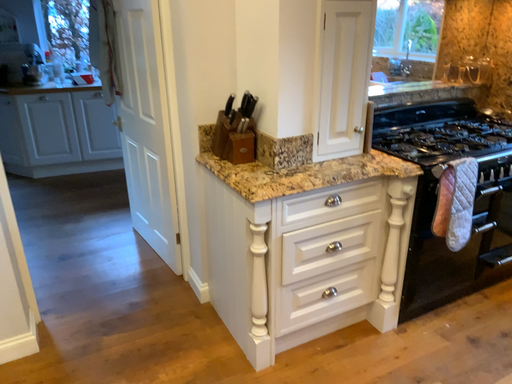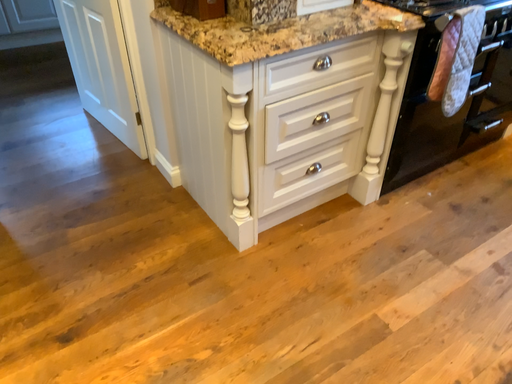
Question: How did the camera likely rotate when shooting the video?

Choices:
 (A) rotated upward
 (B) rotated downward

Answer: (B)